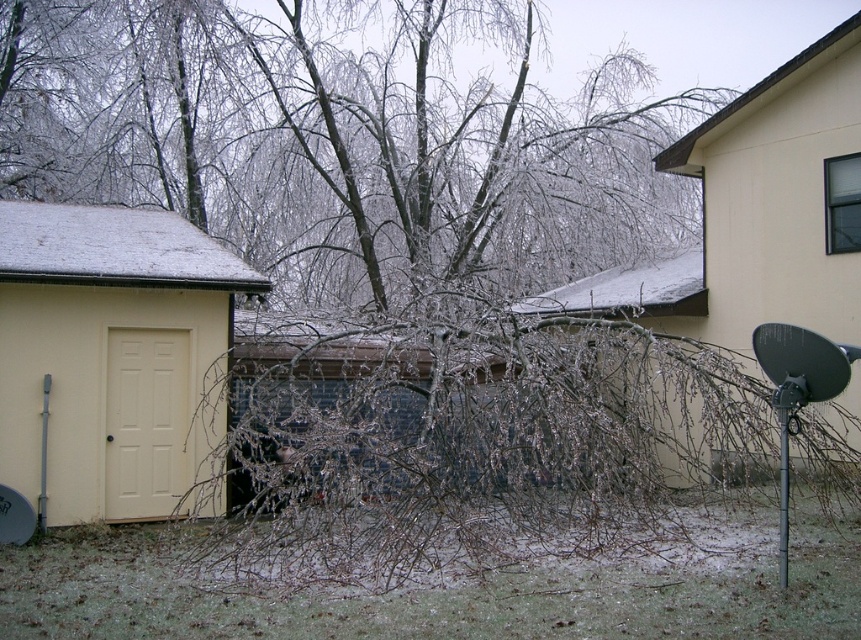
Question: Which object is closer to the camera taking this photo?

Choices:
 (A) frozen wood branches at center
 (B) yellow matte door at left
 (C) frosted branches at center

Answer: (C)

Question: Estimate the real-world distances between objects in this image. Which object is closer to the yellow matte door at left?

Choices:
 (A) frozen wood branches at center
 (B) frosted branches at center

Answer: (B)

Question: Can you confirm if frozen wood branches at center is positioned to the right of frosted branches at center?

Choices:
 (A) no
 (B) yes

Answer: (B)

Question: Does frosted branches at center have a smaller size compared to yellow matte door at left?

Choices:
 (A) yes
 (B) no

Answer: (A)

Question: Is frosted branches at center thinner than yellow matte door at left?

Choices:
 (A) yes
 (B) no

Answer: (B)

Question: Considering the real-world distances, which object is farthest from the yellow matte door at left?

Choices:
 (A) frozen wood branches at center
 (B) frosted branches at center

Answer: (A)